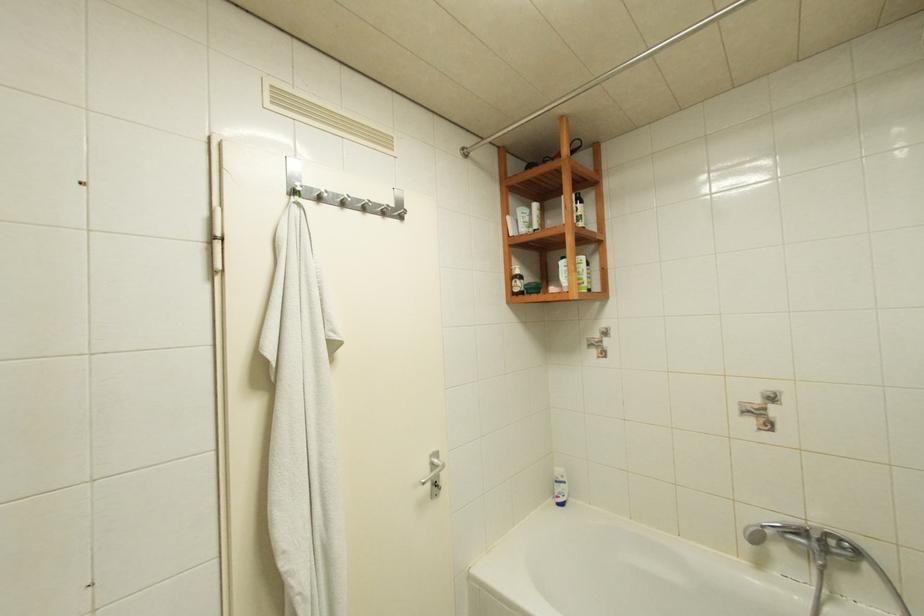
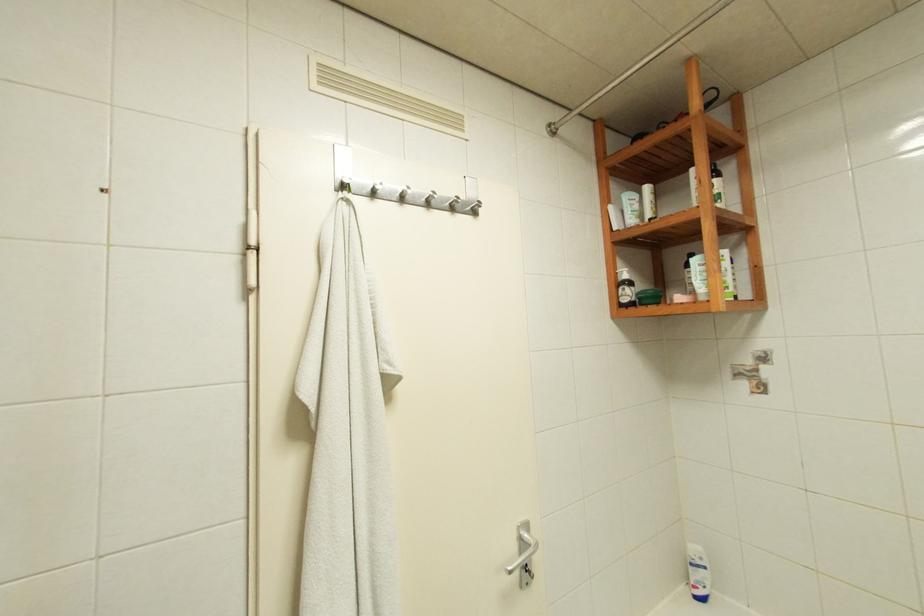
Question: The images are taken continuously from a first-person perspective. In which direction are you moving?

Choices:
 (A) Left
 (B) Right
 (C) Forward
 (D) Backward

Answer: (C)